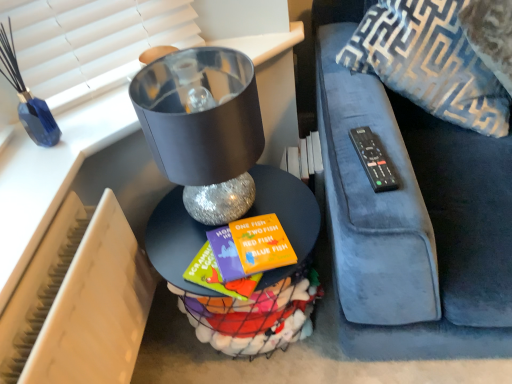
Identify the location of beige plastic radiator at lower left. Image resolution: width=512 pixels, height=384 pixels. (79, 301).

The image size is (512, 384). Describe the element at coordinates (79, 301) in the screenshot. I see `beige plastic radiator at lower left` at that location.

This screenshot has height=384, width=512. What do you see at coordinates (203, 127) in the screenshot?
I see `shiny metallic lampshade at center` at bounding box center [203, 127].

Find the location of a particular element. beige plastic radiator at lower left is located at coordinates (79, 301).

Is black plastic remote at right further to camera compared to blue textured throw pillow at upper right?

No, it is not.

From a real-world perspective, is black plastic remote at right positioned under blue textured throw pillow at upper right based on gravity?

Yes, from a real-world perspective, black plastic remote at right is below blue textured throw pillow at upper right.

Visually, is black plastic remote at right positioned to the left or to the right of blue textured throw pillow at upper right?

black plastic remote at right is positioned on blue textured throw pillow at upper right's left side.

Is black plastic remote at right directly adjacent to blue textured throw pillow at upper right?

No.

From the image's perspective, does metallic silver table at center appear lower than black plastic remote at right?

Yes, from the image's perspective, metallic silver table at center is below black plastic remote at right.

Which is more to the left, metallic silver table at center or black plastic remote at right?

metallic silver table at center.

Between metallic silver table at center and black plastic remote at right, which one has smaller size?

With smaller size is black plastic remote at right.

Looking at their sizes, would you say metallic silver table at center is wider or thinner than black plastic remote at right?

metallic silver table at center is wider than black plastic remote at right.

Considering the positions of objects shiny metallic lampshade at center and blue textured throw pillow at upper right in the image provided, who is behind, shiny metallic lampshade at center or blue textured throw pillow at upper right?

blue textured throw pillow at upper right is further from the camera.

Which of these two, shiny metallic lampshade at center or blue textured throw pillow at upper right, stands taller?

With more height is blue textured throw pillow at upper right.

From a real-world perspective, does shiny metallic lampshade at center sit lower than blue textured throw pillow at upper right?

Actually, shiny metallic lampshade at center is physically above blue textured throw pillow at upper right in the real world.

From the image's perspective, is black plastic remote at right on beige plastic radiator at lower left?

Indeed, from the image's perspective, black plastic remote at right is shown above beige plastic radiator at lower left.

Is the position of black plastic remote at right less distant than that of beige plastic radiator at lower left?

No, black plastic remote at right is further to the viewer.

From a real-world perspective, between black plastic remote at right and beige plastic radiator at lower left, who is vertically higher?

From a 3D spatial view, black plastic remote at right is above.

Is black plastic remote at right next to beige plastic radiator at lower left and touching it?

black plastic remote at right and beige plastic radiator at lower left are not in contact.

From the picture: Is shiny metallic lampshade at center oriented away from beige plastic radiator at lower left?

No, shiny metallic lampshade at center is not facing the opposite direction of beige plastic radiator at lower left.

Is shiny metallic lampshade at center shorter than beige plastic radiator at lower left?

Yes.

Is shiny metallic lampshade at center in front of or behind beige plastic radiator at lower left in the image?

shiny metallic lampshade at center is behind beige plastic radiator at lower left.

Where is `table lamp above the blue textured throw pillow at upper right (from a real-world perspective)`? This screenshot has height=384, width=512. table lamp above the blue textured throw pillow at upper right (from a real-world perspective) is located at coordinates (203, 127).

From a real-world perspective, is blue textured throw pillow at upper right beneath shiny metallic lampshade at center?

Correct, in the physical world, blue textured throw pillow at upper right is lower than shiny metallic lampshade at center.

Considering the relative sizes of blue textured throw pillow at upper right and shiny metallic lampshade at center in the image provided, is blue textured throw pillow at upper right thinner than shiny metallic lampshade at center?

No.

How distant is metallic silver table at center from beige plastic radiator at lower left?

8.88 inches.

Considering the points (234, 311) and (55, 253), which point is behind, point (234, 311) or point (55, 253)?

The point (234, 311) is more distant.

Can you confirm if metallic silver table at center is positioned to the left of beige plastic radiator at lower left?

No.

This screenshot has width=512, height=384. Find the location of `table directly beneath the beige plastic radiator at lower left (from a real-world perspective)`. table directly beneath the beige plastic radiator at lower left (from a real-world perspective) is located at coordinates (263, 273).

You are a GUI agent. You are given a task and a screenshot of the screen. Output one action in this format:
    pyautogui.click(x=<x>, y=<y>)
    Task: Click on the remote below the blue textured throw pillow at upper right (from the image's perspective)
    
    Given the screenshot: What is the action you would take?
    point(373,160)

Where is `remote lying above the metallic silver table at center (from the image's perspective)`? remote lying above the metallic silver table at center (from the image's perspective) is located at coordinates (373, 160).

From the image, which object appears to be farther from black plastic remote at right, beige plastic radiator at lower left or shiny metallic lampshade at center?

The object further to black plastic remote at right is beige plastic radiator at lower left.

From the image, which object appears to be nearer to beige plastic radiator at lower left, black plastic remote at right or metallic silver table at center?

The object closer to beige plastic radiator at lower left is metallic silver table at center.

Which object lies nearer to the anchor point blue textured throw pillow at upper right, black plastic remote at right or beige plastic radiator at lower left?

black plastic remote at right is positioned closer to the anchor blue textured throw pillow at upper right.

Looking at the image, which one is located closer to metallic silver table at center, beige plastic radiator at lower left or blue textured throw pillow at upper right?

The object closer to metallic silver table at center is beige plastic radiator at lower left.

Based on their spatial positions, is metallic silver table at center or beige plastic radiator at lower left further from shiny metallic lampshade at center?

Among the two, beige plastic radiator at lower left is located further to shiny metallic lampshade at center.

In the scene shown: Looking at the image, which one is located closer to shiny metallic lampshade at center, blue textured throw pillow at upper right or beige plastic radiator at lower left?

Based on the image, beige plastic radiator at lower left appears to be nearer to shiny metallic lampshade at center.

From the image, which object appears to be farther from blue textured throw pillow at upper right, black plastic remote at right or metallic silver table at center?

metallic silver table at center lies further to blue textured throw pillow at upper right than the other object.

Based on their spatial positions, is blue textured throw pillow at upper right or black plastic remote at right further from shiny metallic lampshade at center?

Among the two, blue textured throw pillow at upper right is located further to shiny metallic lampshade at center.

Identify the location of table lamp located between beige plastic radiator at lower left and black plastic remote at right in the left-right direction. (203, 127).

Find the location of a particular element. The image size is (512, 384). table situated between beige plastic radiator at lower left and blue textured throw pillow at upper right from left to right is located at coordinates (263, 273).

Locate an element on the screen. This screenshot has width=512, height=384. remote located between beige plastic radiator at lower left and blue textured throw pillow at upper right in the left-right direction is located at coordinates (373, 160).

At what (x,y) coordinates should I click in order to perform the action: click on table lamp between blue textured throw pillow at upper right and metallic silver table at center from top to bottom. Please return your answer as a coordinate pair (x, y). The height and width of the screenshot is (384, 512). Looking at the image, I should click on (203, 127).